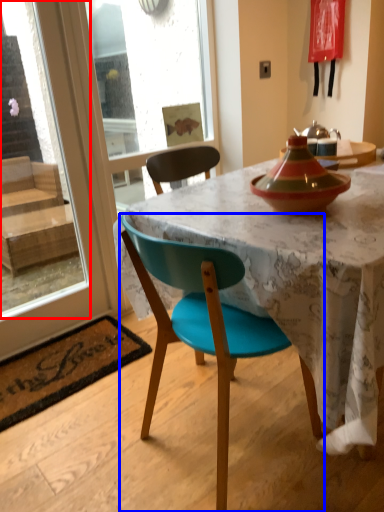
Question: Which object appears farthest to the camera in this image, window screen (highlighted by a red box) or chair (highlighted by a blue box)?

Choices:
 (A) window screen
 (B) chair

Answer: (A)